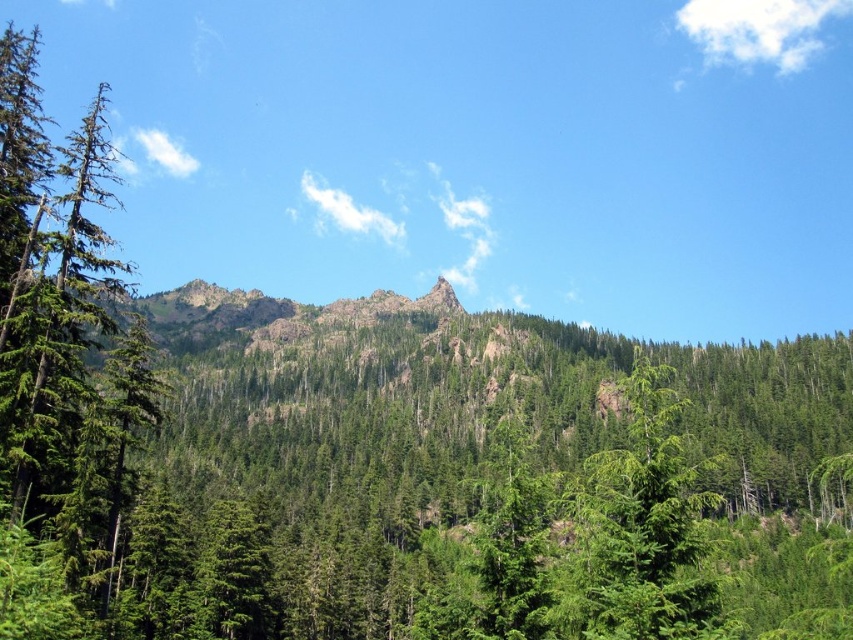
Question: Does green matte tree at left have a smaller size compared to green matte tree at center?

Choices:
 (A) no
 (B) yes

Answer: (A)

Question: Is green matte tree at left further to the viewer compared to green matte tree at center?

Choices:
 (A) yes
 (B) no

Answer: (B)

Question: Among these objects, which one is nearest to the camera?

Choices:
 (A) green matte tree at center
 (B) green matte tree at left

Answer: (B)

Question: Which of the following is the closest to the observer?

Choices:
 (A) (592, 536)
 (B) (28, 465)

Answer: (B)

Question: Which point is closer to the camera taking this photo?

Choices:
 (A) (659, 516)
 (B) (32, 273)

Answer: (A)

Question: Can you confirm if green matte tree at left is positioned above green matte tree at center?

Choices:
 (A) no
 (B) yes

Answer: (B)